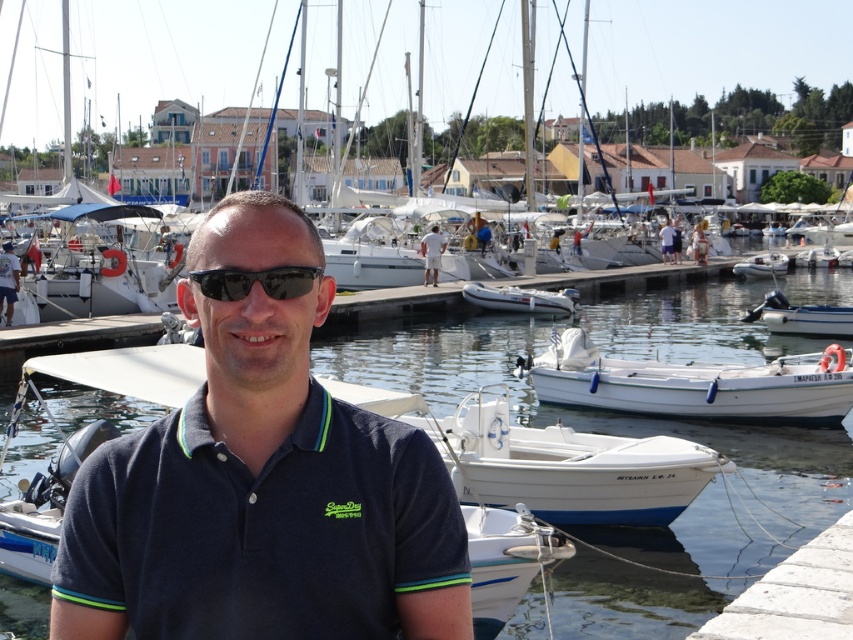
Question: Can you confirm if navy blue cotton polo shirt at center is positioned to the right of black plastic sunglasses at center?

Choices:
 (A) yes
 (B) no

Answer: (B)

Question: Which point is closer to the camera taking this photo?

Choices:
 (A) (299, 280)
 (B) (560, 420)

Answer: (A)

Question: Can you confirm if navy blue cotton polo shirt at center is positioned to the right of white matte boat at lower right?

Choices:
 (A) no
 (B) yes

Answer: (A)

Question: Is white matte boat at lower right positioned at the back of white matte shorts at center?

Choices:
 (A) no
 (B) yes

Answer: (A)

Question: Which point appears farthest from the camera in this image?

Choices:
 (A) (236, 275)
 (B) (440, 243)
 (C) (781, 257)

Answer: (C)

Question: Which is farther from the white matte shorts at center?

Choices:
 (A) white matte boat at lower right
 (B) navy blue cotton polo shirt at center
 (C) black plastic sunglasses at center

Answer: (C)